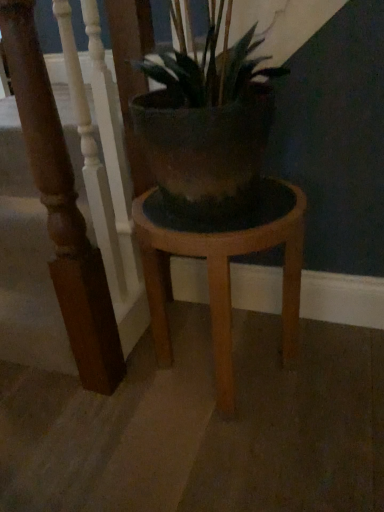
Question: Does wooden stair rail at left lie behind wooden stool at center?

Choices:
 (A) yes
 (B) no

Answer: (B)

Question: Are wooden stair rail at left and wooden stool at center far apart?

Choices:
 (A) no
 (B) yes

Answer: (A)

Question: Does wooden stair rail at left appear on the right side of wooden stool at center?

Choices:
 (A) yes
 (B) no

Answer: (B)

Question: Considering the relative sizes of wooden stair rail at left and wooden stool at center in the image provided, is wooden stair rail at left thinner than wooden stool at center?

Choices:
 (A) yes
 (B) no

Answer: (A)

Question: From the image's perspective, would you say wooden stair rail at left is shown under wooden stool at center?

Choices:
 (A) no
 (B) yes

Answer: (A)

Question: Is wooden stair rail at left oriented away from wooden stool at center?

Choices:
 (A) yes
 (B) no

Answer: (A)

Question: From the image's perspective, does wooden stool at center appear lower than wooden stair rail at left?

Choices:
 (A) yes
 (B) no

Answer: (A)

Question: Does wooden stool at center have a lesser height compared to wooden stair rail at left?

Choices:
 (A) yes
 (B) no

Answer: (A)

Question: Would you say wooden stool at center is outside wooden stair rail at left?

Choices:
 (A) yes
 (B) no

Answer: (A)

Question: Would you consider wooden stool at center to be distant from wooden stair rail at left?

Choices:
 (A) yes
 (B) no

Answer: (B)

Question: Does wooden stool at center come in front of wooden stair rail at left?

Choices:
 (A) no
 (B) yes

Answer: (A)

Question: Can you confirm if wooden stool at center is smaller than wooden stair rail at left?

Choices:
 (A) no
 (B) yes

Answer: (A)

Question: In the image, is wooden stool at center on the left side or the right side of wooden stair rail at left?

Choices:
 (A) left
 (B) right

Answer: (B)